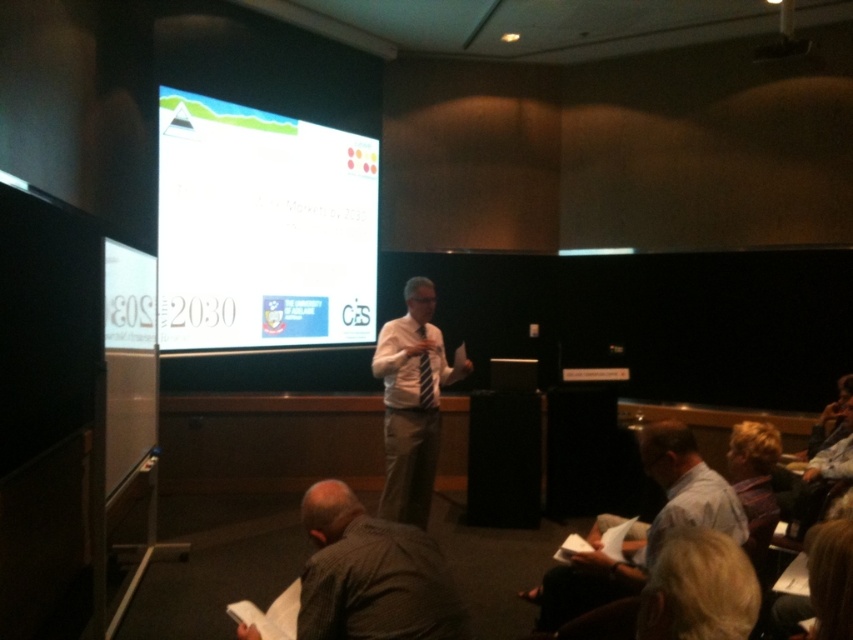
Consider the image. Who is positioned more to the left, light blue shirt at lower right or blonde hair at lower right?

From the viewer's perspective, blonde hair at lower right appears more on the left side.

Does light blue shirt at lower right have a greater width compared to blonde hair at lower right?

Yes.

Between point (665, 492) and point (688, 528), which one is positioned behind?

The point (665, 492) is behind.

Where is `light blue shirt at lower right`? light blue shirt at lower right is located at coordinates (646, 529).

Looking at this image, who is shorter, white glossy projection screen at upper center or dark brown shirt at lower center?

With less height is dark brown shirt at lower center.

Between point (157, 220) and point (318, 502), which one is positioned in front?

Point (318, 502) is more forward.

Locate an element on the screen. The image size is (853, 640). white glossy projection screen at upper center is located at coordinates (262, 228).

Can you confirm if dark brown shirt at lower center is positioned above white shirt at center?

Incorrect, dark brown shirt at lower center is not positioned above white shirt at center.

Which is behind, point (346, 564) or point (410, 276)?

Point (410, 276)

Identify the location of dark brown shirt at lower center. (372, 576).